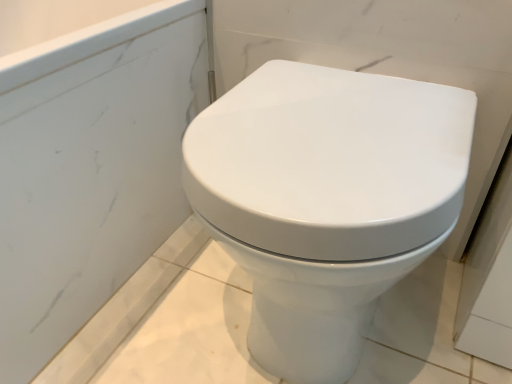
This screenshot has width=512, height=384. I want to click on white glossy toilet at center, so click(x=326, y=199).

Image resolution: width=512 pixels, height=384 pixels. Describe the element at coordinates (326, 199) in the screenshot. I see `white glossy toilet at center` at that location.

In order to face white glossy toilet at center, should I rotate leftwards or rightwards?

A 9.498 degree turn to the right will do.

At what (x,y) coordinates should I click in order to perform the action: click on white glossy toilet at center. Please return your answer as a coordinate pair (x, y). The width and height of the screenshot is (512, 384). Looking at the image, I should click on (326, 199).